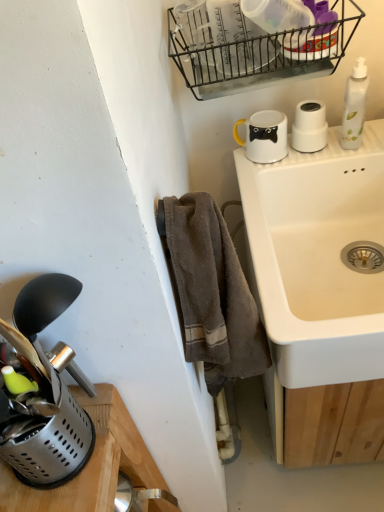
Question: Can you see black wire basket at upper center touching white matte cup at upper right, marked as the 1th appliance in a top-to-bottom arrangement?

Choices:
 (A) no
 (B) yes

Answer: (A)

Question: Is black wire basket at upper center turned away from white matte cup at upper right, the first appliance when ordered from back to front?

Choices:
 (A) yes
 (B) no

Answer: (B)

Question: Does black wire basket at upper center have a lesser width compared to white matte cup at upper right, marked as the 1th appliance in a top-to-bottom arrangement?

Choices:
 (A) no
 (B) yes

Answer: (A)

Question: Does black wire basket at upper center have a greater width compared to white matte cup at upper right, marked as the 1th appliance in a top-to-bottom arrangement?

Choices:
 (A) no
 (B) yes

Answer: (B)

Question: From a real-world perspective, is black wire basket at upper center on white matte cup at upper right, marked as the 1th appliance in a top-to-bottom arrangement?

Choices:
 (A) no
 (B) yes

Answer: (B)

Question: Can you confirm if black wire basket at upper center is shorter than white matte cup at upper right, the 3th appliance when ordered from front to back?

Choices:
 (A) no
 (B) yes

Answer: (A)

Question: Is brown cotton towel at lower center positioned far away from metallic silver utensil holder at lower left, the first appliance ordered from the bottom?

Choices:
 (A) yes
 (B) no

Answer: (B)

Question: Does brown cotton towel at lower center appear on the left side of metallic silver utensil holder at lower left, the 3th appliance positioned from the right?

Choices:
 (A) no
 (B) yes

Answer: (A)

Question: Considering the relative sizes of brown cotton towel at lower center and metallic silver utensil holder at lower left, the 3th appliance from the top, in the image provided, is brown cotton towel at lower center taller than metallic silver utensil holder at lower left, the 3th appliance from the top,?

Choices:
 (A) no
 (B) yes

Answer: (B)

Question: Is brown cotton towel at lower center bigger than metallic silver utensil holder at lower left, marked as the 1th appliance in a front-to-back arrangement?

Choices:
 (A) yes
 (B) no

Answer: (A)

Question: Does brown cotton towel at lower center have a lesser height compared to metallic silver utensil holder at lower left, the 3th appliance positioned from the right?

Choices:
 (A) yes
 (B) no

Answer: (B)

Question: From the image's perspective, is brown cotton towel at lower center over metallic silver utensil holder at lower left, which is counted as the third appliance, starting from the back?

Choices:
 (A) yes
 (B) no

Answer: (A)

Question: Considering the relative sizes of white matte cup at upper right, the third appliance ordered from the bottom, and metallic silver utensil holder at lower left, the first appliance ordered from the bottom, in the image provided, is white matte cup at upper right, the third appliance ordered from the bottom, wider than metallic silver utensil holder at lower left, the first appliance ordered from the bottom,?

Choices:
 (A) no
 (B) yes

Answer: (A)